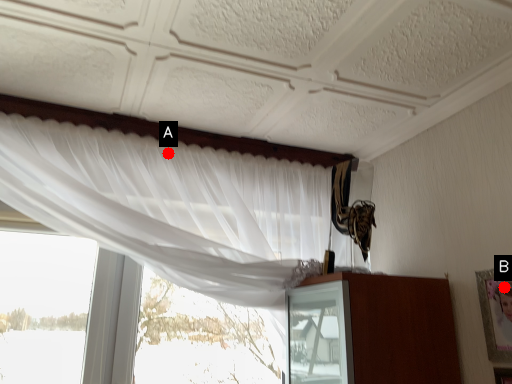
Question: Two points are circled on the image, labeled by A and B beside each circle. Which point is farther from the camera taking this photo?

Choices:
 (A) A is further
 (B) B is further

Answer: (A)